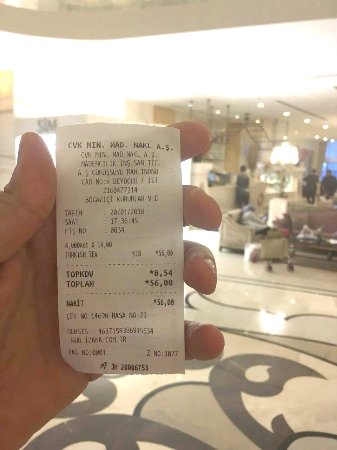
At what (x,y) coordinates should I click in order to perform the action: click on chair. Please return your answer as a coordinate pair (x, y). Image resolution: width=337 pixels, height=450 pixels. Looking at the image, I should click on (234, 231).